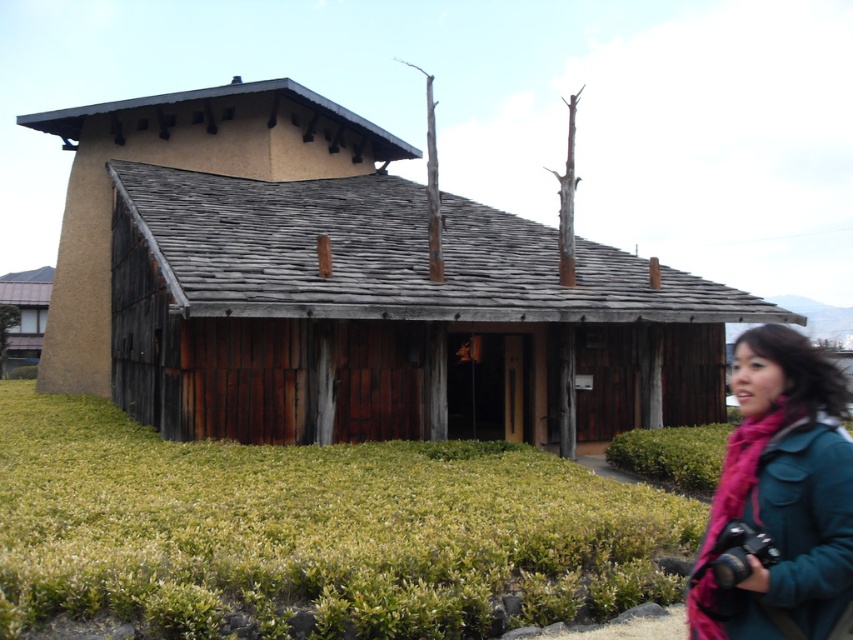
Is the position of brown wooden hut at center more distant than that of teal fabric scarf at lower right?

Yes, brown wooden hut at center is further from the viewer.

Can you confirm if brown wooden hut at center is smaller than teal fabric scarf at lower right?

No, brown wooden hut at center is not smaller than teal fabric scarf at lower right.

Is point (584, 259) farther from camera compared to point (746, 460)?

Yes, point (584, 259) is behind point (746, 460).

The height and width of the screenshot is (640, 853). What are the coordinates of `brown wooden hut at center` in the screenshot? It's located at (347, 289).

Who is positioned more to the right, brown wooden hut at center or matte brown wooden hut at lower left?

brown wooden hut at center is more to the right.

Locate an element on the screen. This screenshot has width=853, height=640. brown wooden hut at center is located at coordinates (347, 289).

This screenshot has width=853, height=640. Identify the location of brown wooden hut at center. (347, 289).

You are a GUI agent. You are given a task and a screenshot of the screen. Output one action in this format:
    pyautogui.click(x=<x>, y=<y>)
    Task: Click on the brown wooden hut at center
    The height and width of the screenshot is (640, 853).
    Given the screenshot: What is the action you would take?
    pyautogui.click(x=347, y=289)

Describe the element at coordinates (780, 496) in the screenshot. This screenshot has height=640, width=853. I see `teal fabric scarf at lower right` at that location.

In the scene shown: Is teal fabric scarf at lower right to the right of matte brown wooden hut at lower left from the viewer's perspective?

Correct, you'll find teal fabric scarf at lower right to the right of matte brown wooden hut at lower left.

What are the coordinates of `teal fabric scarf at lower right` in the screenshot? It's located at coord(780,496).